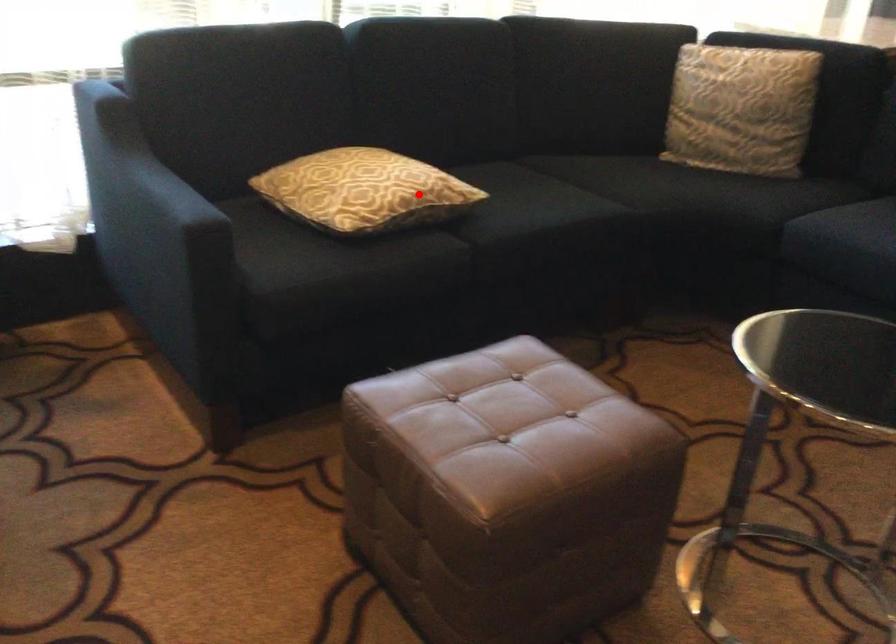
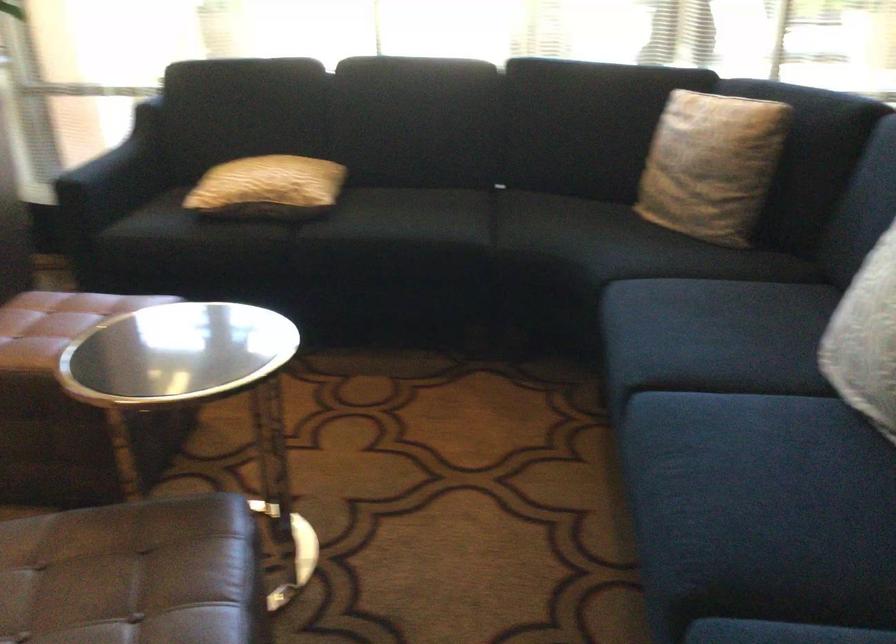
Find the pixel in the second image that matches the highlighted location in the first image.

(268, 187)